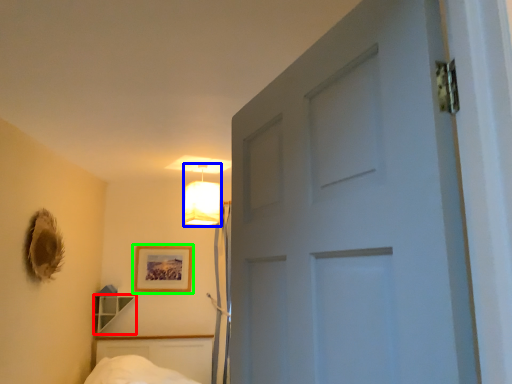
Question: Which is farther away from shelf (highlighted by a red box)? lamp (highlighted by a blue box) or picture frame (highlighted by a green box)?

Choices:
 (A) lamp
 (B) picture frame

Answer: (A)